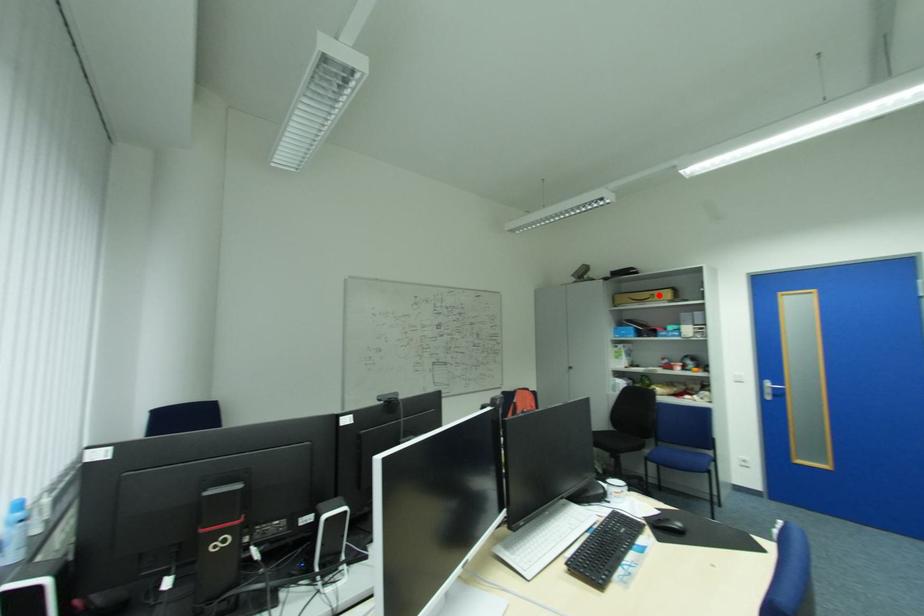
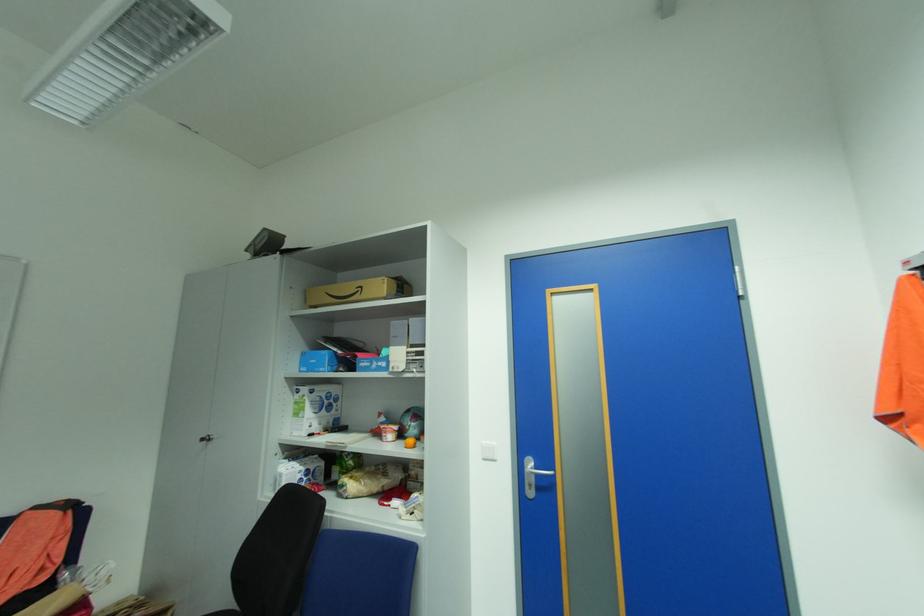
Find the pixel in the second image that matches the highlighted location in the first image.

(368, 286)